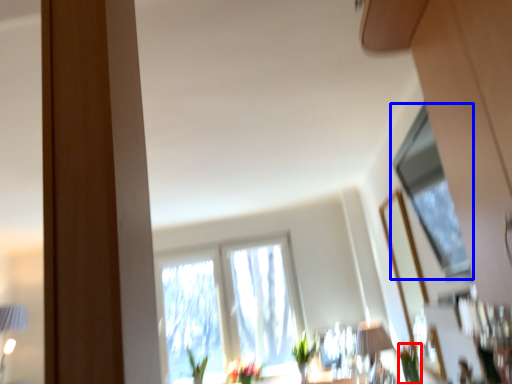
Question: Which point is further to the camera, plant (highlighted by a red box) or window (highlighted by a blue box)?

Choices:
 (A) plant
 (B) window

Answer: (A)